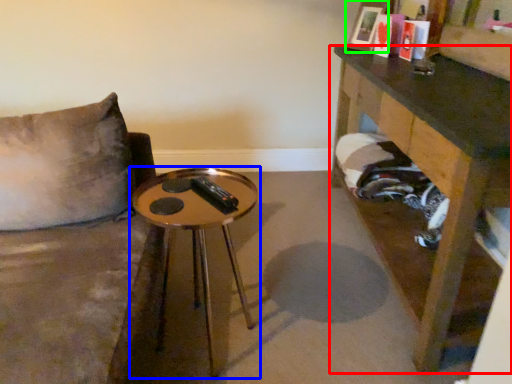
Question: Based on their relative distances, which object is nearer to table (highlighted by a red box)? Choose from table (highlighted by a blue box) and picture frame (highlighted by a green box).

Choices:
 (A) table
 (B) picture frame

Answer: (B)